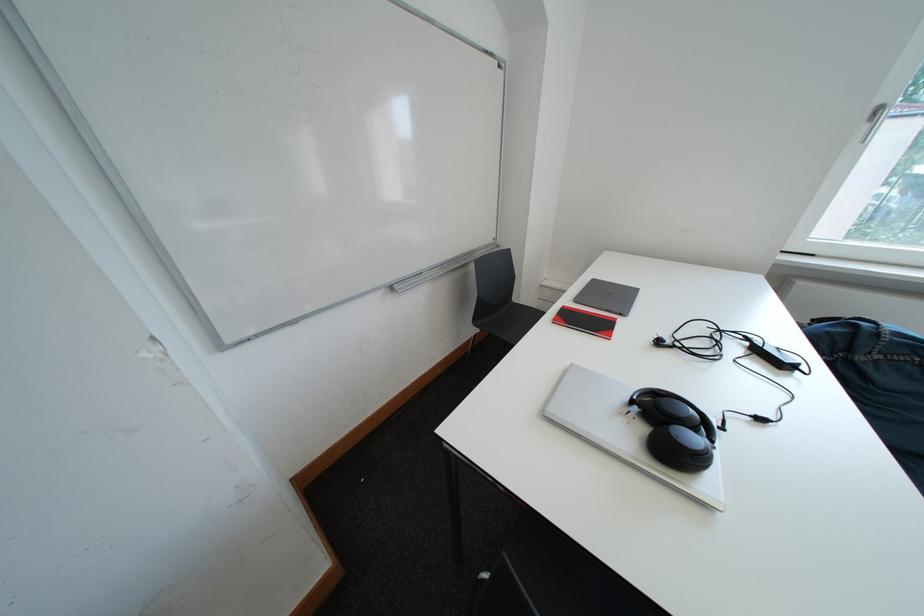
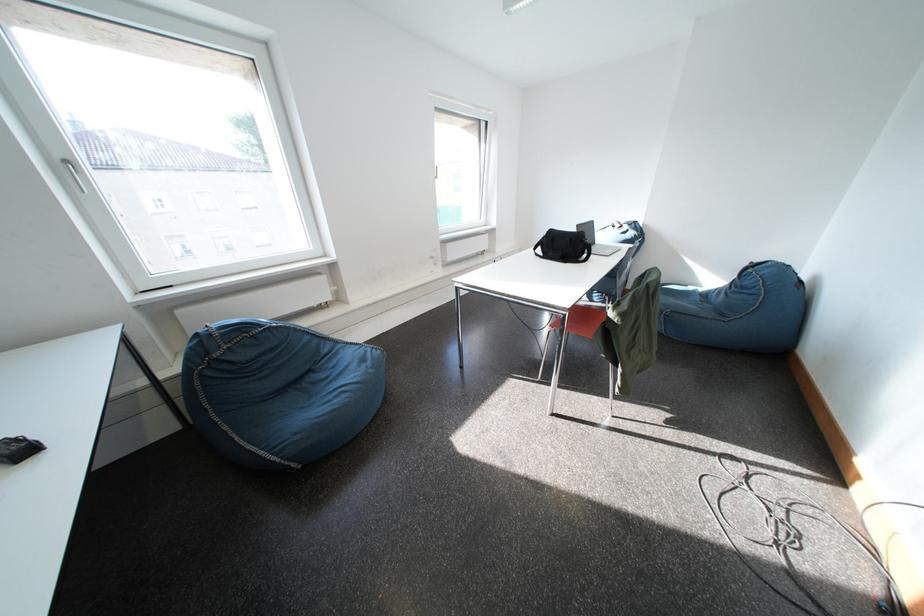
How did the camera likely rotate?

The camera rotated toward right-down.